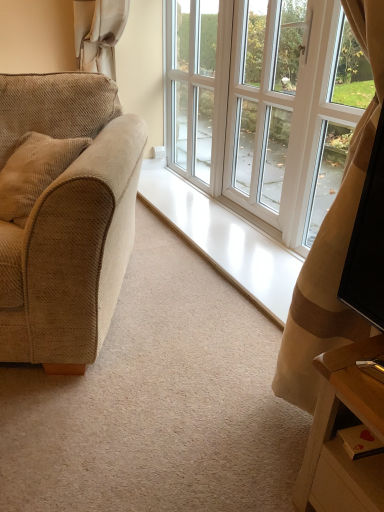
Identify the location of vacant space in front of white glass window at center. The width and height of the screenshot is (384, 512). tap(210, 438).